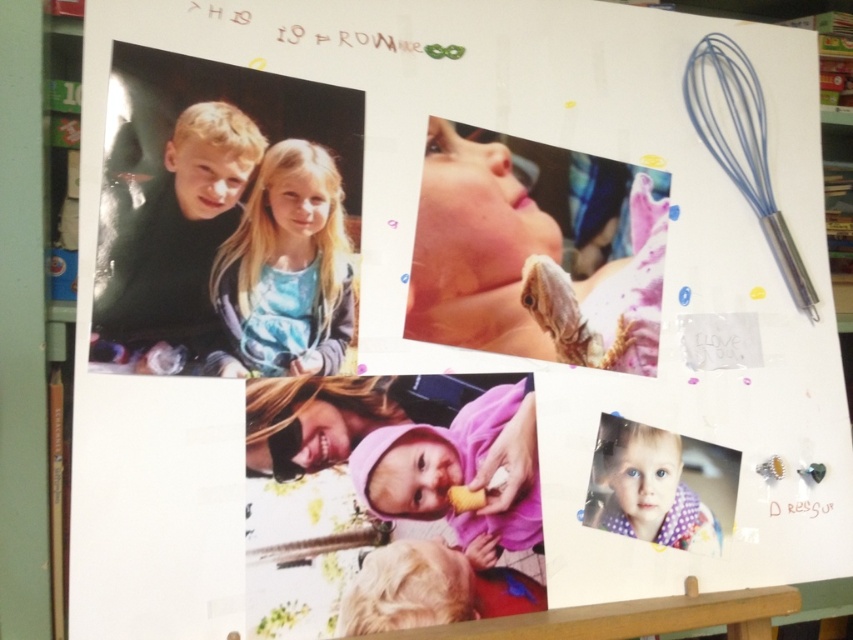
Question: Which object appears closest to the camera in this image?

Choices:
 (A) blue rubber whisk at upper right
 (B) fluffy golden hair at center

Answer: (B)

Question: Can you confirm if blue fabric dress at upper left is bigger than fluffy golden hair at center?

Choices:
 (A) yes
 (B) no

Answer: (A)

Question: Which point is farther to the camera?

Choices:
 (A) (247, 340)
 (B) (601, 262)
 (C) (637, 524)

Answer: (B)

Question: Does blue rubber whisk at upper right have a smaller size compared to polka dot fabric at lower right?

Choices:
 (A) yes
 (B) no

Answer: (B)

Question: Can you confirm if smooth skin at center is positioned below polka dot fabric at lower right?

Choices:
 (A) yes
 (B) no

Answer: (B)

Question: Which of the following is the farthest from the observer?

Choices:
 (A) (352, 602)
 (B) (630, 458)
 (C) (465, 316)

Answer: (B)